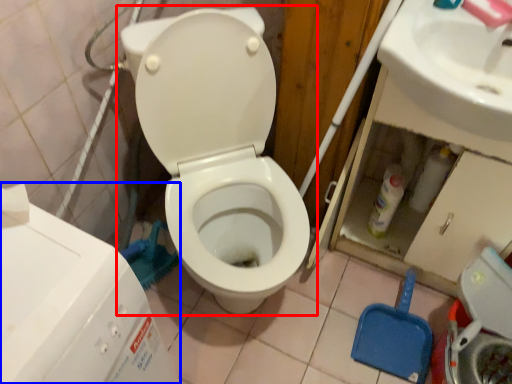
Question: Which point is closer to the camera, toilet (highlighted by a red box) or water tank (highlighted by a blue box)?

Choices:
 (A) toilet
 (B) water tank

Answer: (B)